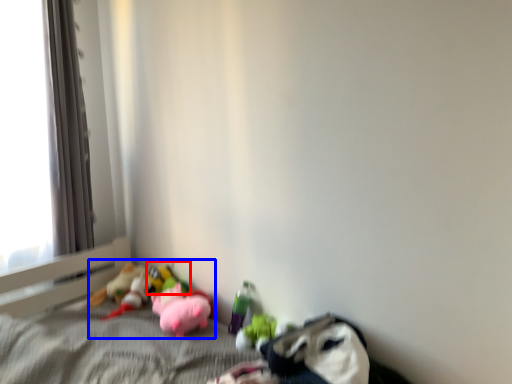
Question: Which object appears farthest to the camera in this image, toy (highlighted by a red box) or stuff (highlighted by a blue box)?

Choices:
 (A) toy
 (B) stuff

Answer: (A)